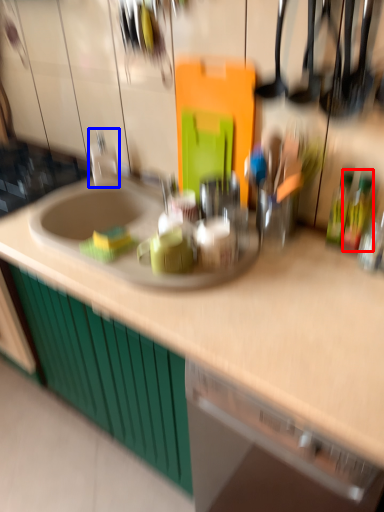
Question: Which object is closer to the camera taking this photo, bottle (highlighted by a red box) or faucet (highlighted by a blue box)?

Choices:
 (A) bottle
 (B) faucet

Answer: (A)